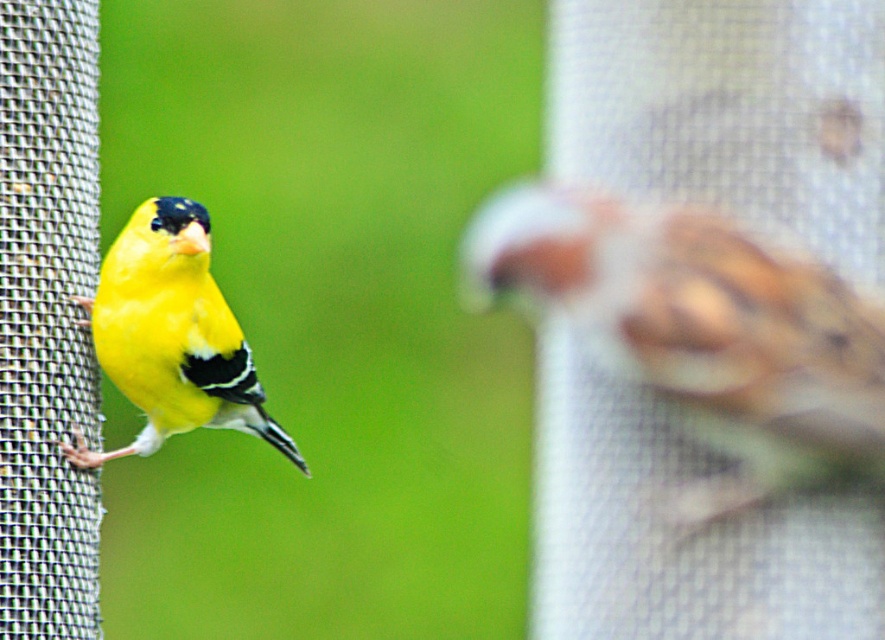
Is point (825, 445) farther from camera compared to point (283, 440)?

No, it is in front of (283, 440).

Looking at this image, is brown speckled sparrow at right to the left of shiny yellow canary at left from the viewer's perspective?

Incorrect, brown speckled sparrow at right is not on the left side of shiny yellow canary at left.

Between point (873, 381) and point (98, 317), which one is positioned behind?

The point (98, 317) is behind.

Find the location of a particular element. The image size is (885, 640). brown speckled sparrow at right is located at coordinates (702, 330).